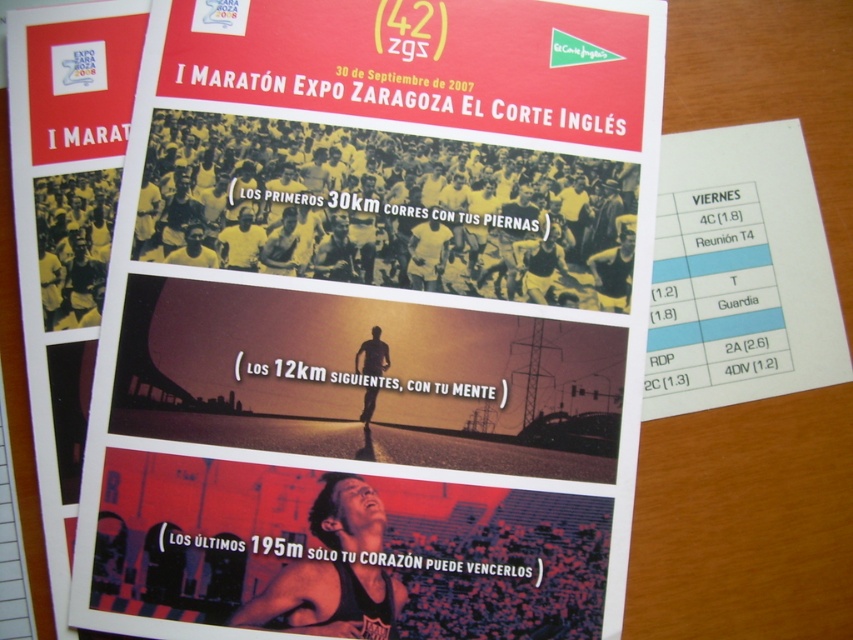
Is point (418, 548) less distant than point (659, 273)?

Yes, point (418, 548) is in front of point (659, 273).

Can you confirm if matte black runner at lower center is bigger than white paper at upper right?

Correct, matte black runner at lower center is larger in size than white paper at upper right.

Locate an element on the screen. This screenshot has height=640, width=853. matte black runner at lower center is located at coordinates (344, 552).